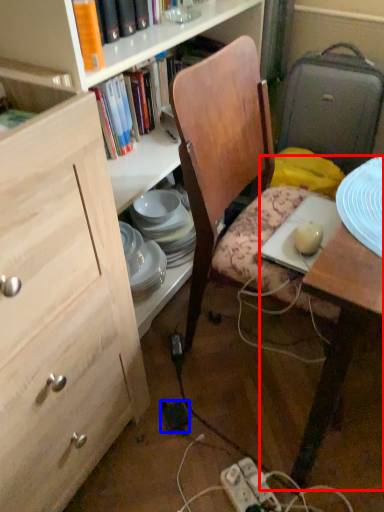
Question: Which of the following is the closest to the observer, desk (highlighted by a red box) or power plugs and sockets (highlighted by a blue box)?

Choices:
 (A) desk
 (B) power plugs and sockets

Answer: (A)